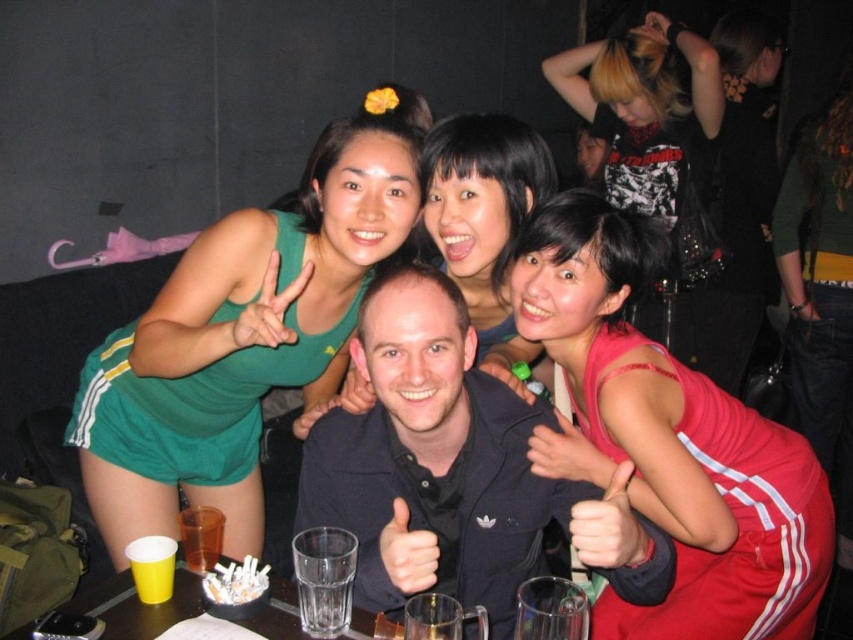
Is black matte jacket at center thinner than green jersey at upper left?

No.

Does point (428, 464) lie in front of point (527, 132)?

That is True.

Is point (396, 424) in front of point (347, 378)?

Yes, point (396, 424) is closer to viewer.

Locate an element on the screen. The image size is (853, 640). black matte jacket at center is located at coordinates (454, 470).

The height and width of the screenshot is (640, 853). What do you see at coordinates (244, 336) in the screenshot? I see `green fabric dress at upper left` at bounding box center [244, 336].

Does green fabric dress at upper left have a larger size compared to black matte jacket at center?

Correct, green fabric dress at upper left is larger in size than black matte jacket at center.

Is point (199, 417) farther from viewer compared to point (376, 284)?

Yes, point (199, 417) is behind point (376, 284).

The width and height of the screenshot is (853, 640). I want to click on green fabric dress at upper left, so click(244, 336).

In the scene shown: Which is more to the left, red shiny dress at center or translucent plastic cup at lower left?

translucent plastic cup at lower left is more to the left.

Does red shiny dress at center come behind translucent plastic cup at lower left?

Yes.

Does point (616, 273) come closer to viewer compared to point (184, 557)?

No, it is not.

The height and width of the screenshot is (640, 853). Identify the location of red shiny dress at center. (668, 440).